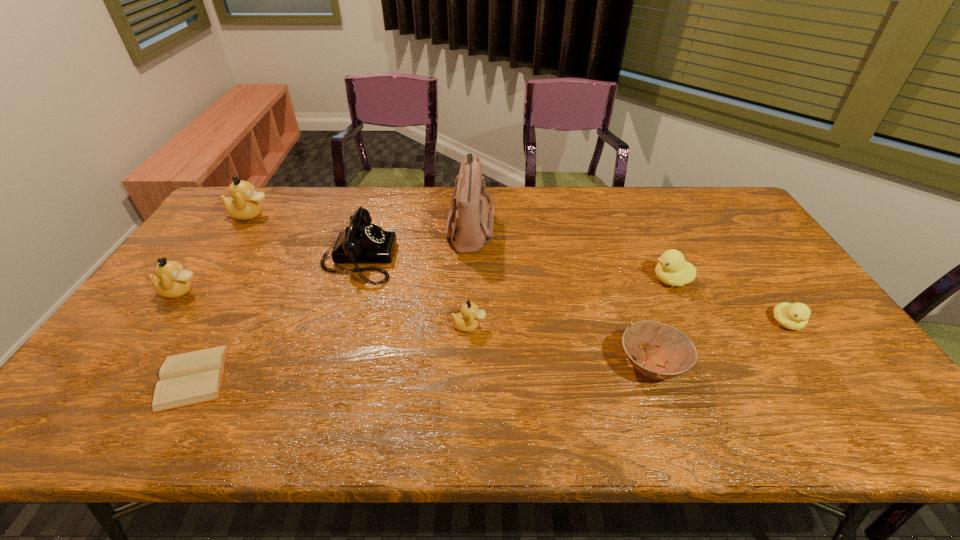
Select which object is the third closest to the diary. Please provide its 2D coordinates. Your answer should be formatted as a tuple, i.e. [(x, y)], where the tuple contains the x and y coordinates of a point satisfying the conditions above.

[(467, 320)]

Locate which duckling is the third closest to the bowl. Please provide its 2D coordinates. Your answer should be formatted as a tuple, i.e. [(x, y)], where the tuple contains the x and y coordinates of a point satisfying the conditions above.

[(467, 320)]

Choose which duckling is the third nearest neighbor to the fourth duckling from left to right. Please provide its 2D coordinates. Your answer should be formatted as a tuple, i.e. [(x, y)], where the tuple contains the x and y coordinates of a point satisfying the conditions above.

[(243, 204)]

At what (x,y) coordinates should I click in order to perform the action: click on tan duckling that is the nearest to the second nearest tan duckling. Please return your answer as a coordinate pair (x, y). Looking at the image, I should click on (243, 204).

Identify which tan duckling is the second closest to the tallest duckling. Please provide its 2D coordinates. Your answer should be formatted as a tuple, i.e. [(x, y)], where the tuple contains the x and y coordinates of a point satisfying the conditions above.

[(467, 320)]

Identify the location of free location that satisfies the following two spatial constraints: 1. on the back side of the seventh object from left to right; 2. on the face of the tallest duckling. (599, 214).

I want to click on free space that satisfies the following two spatial constraints: 1. on the face of the rightmost tan duckling; 2. on the back side of the seventh object from left to right, so click(468, 365).

Locate an element on the screen. Image resolution: width=960 pixels, height=540 pixels. vacant space that satisfies the following two spatial constraints: 1. on the face of the bowl; 2. on the left side of the tallest duckling is located at coordinates (147, 365).